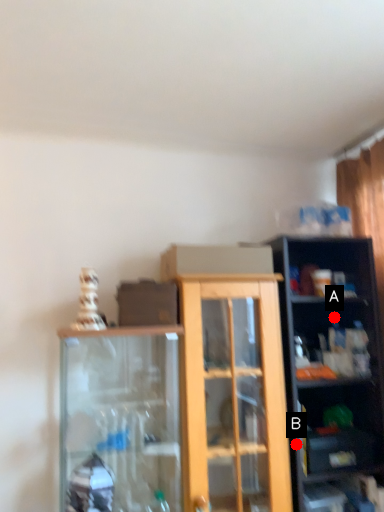
Question: Two points are circled on the image, labeled by A and B beside each circle. Among these points, which one is farthest from the camera?

Choices:
 (A) A is further
 (B) B is further

Answer: (A)